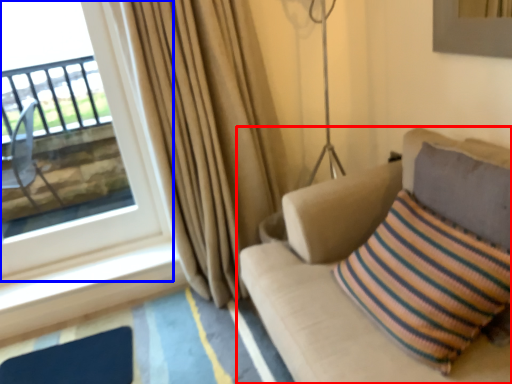
Question: Among these objects, which one is farthest to the camera, studio couch (highlighted by a red box) or window (highlighted by a blue box)?

Choices:
 (A) studio couch
 (B) window

Answer: (B)